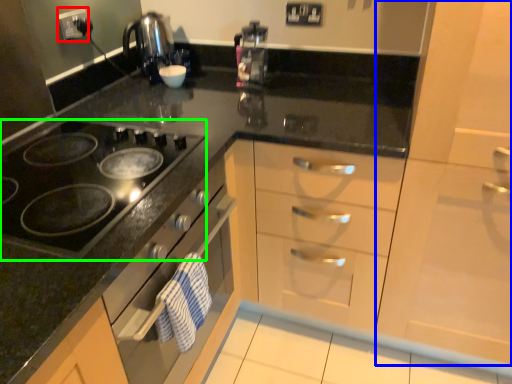
Question: Which object is the closest to the electric outlet (highlighted by a red box)? Choose among these: cabinetry (highlighted by a blue box) or gas stove (highlighted by a green box).

Choices:
 (A) cabinetry
 (B) gas stove

Answer: (B)